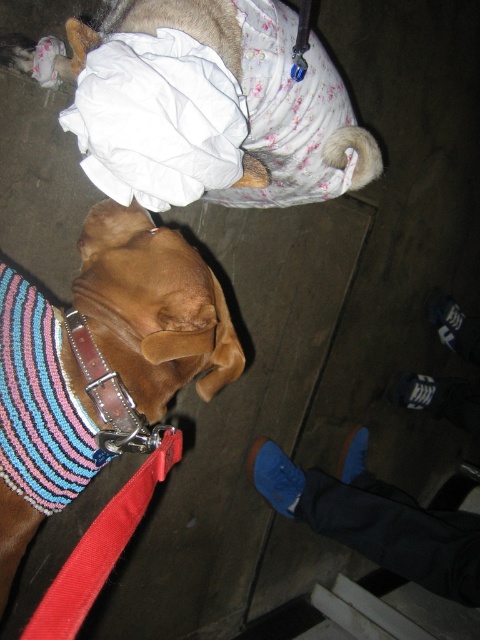
Question: Which point appears closest to the camera in this image?

Choices:
 (A) (148, 330)
 (B) (164, 428)
 (C) (141, 484)

Answer: (C)

Question: Which point is farther to the camera?

Choices:
 (A) red fabric leash at lower left
 (B) leather at left
 (C) fluffy white fur at upper center
 (D) brown leather dog at lower left

Answer: (B)

Question: Is brown leather dog at lower left wider than red fabric leash at lower left?

Choices:
 (A) no
 (B) yes

Answer: (B)

Question: Which object is closer to the camera taking this photo?

Choices:
 (A) red fabric leash at lower left
 (B) brown leather dog at lower left
 (C) fluffy white fur at upper center

Answer: (A)

Question: Is the position of fluffy white fur at upper center more distant than that of red fabric leash at lower left?

Choices:
 (A) yes
 (B) no

Answer: (A)

Question: Is brown leather dog at lower left thinner than leather at left?

Choices:
 (A) no
 (B) yes

Answer: (A)